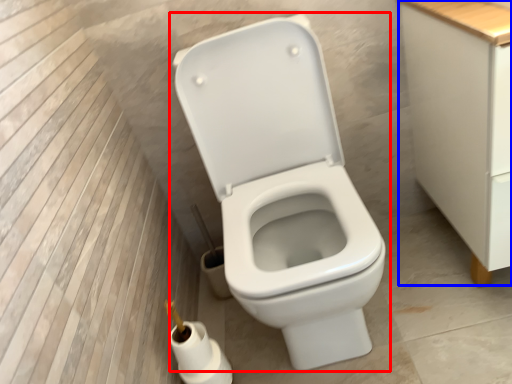
Question: Which point is further to the camera, toilet (highlighted by a red box) or cabinetry (highlighted by a blue box)?

Choices:
 (A) toilet
 (B) cabinetry

Answer: (B)